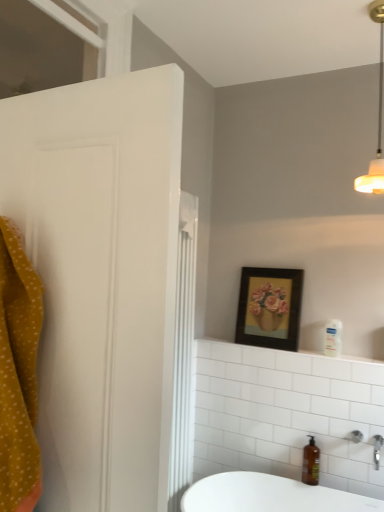
Question: Does transparent glass window at upper left have a lesser height compared to white glossy shelf at upper center?

Choices:
 (A) no
 (B) yes

Answer: (A)

Question: Is transparent glass window at upper left positioned in front of white glossy shelf at upper center?

Choices:
 (A) yes
 (B) no

Answer: (A)

Question: Is white glossy shelf at upper center located within transparent glass window at upper left?

Choices:
 (A) yes
 (B) no

Answer: (B)

Question: Can you confirm if transparent glass window at upper left is thinner than white glossy shelf at upper center?

Choices:
 (A) yes
 (B) no

Answer: (A)

Question: Does transparent glass window at upper left have a greater height compared to white glossy shelf at upper center?

Choices:
 (A) no
 (B) yes

Answer: (B)

Question: In the image, is wooden framed picture at upper center on the left side or the right side of white matte light fixture at upper right?

Choices:
 (A) right
 (B) left

Answer: (B)

Question: Considering the positions of wooden framed picture at upper center and white matte light fixture at upper right in the image, is wooden framed picture at upper center bigger or smaller than white matte light fixture at upper right?

Choices:
 (A) big
 (B) small

Answer: (B)

Question: From the image's perspective, is wooden framed picture at upper center located above or below white matte light fixture at upper right?

Choices:
 (A) below
 (B) above

Answer: (A)

Question: From their relative heights in the image, would you say wooden framed picture at upper center is taller or shorter than white matte light fixture at upper right?

Choices:
 (A) short
 (B) tall

Answer: (A)

Question: Is silver metallic faucet at lower right spatially inside white glossy shelf at upper center, or outside of it?

Choices:
 (A) inside
 (B) outside

Answer: (B)

Question: Is point (377, 456) positioned closer to the camera than point (382, 352)?

Choices:
 (A) farther
 (B) closer

Answer: (B)

Question: Is silver metallic faucet at lower right wider or thinner than white glossy shelf at upper center?

Choices:
 (A) wide
 (B) thin

Answer: (A)

Question: Considering their positions, is silver metallic faucet at lower right located in front of or behind white glossy shelf at upper center?

Choices:
 (A) front
 (B) behind

Answer: (A)

Question: Is white glossy shelf at upper center taller or shorter than white matte light fixture at upper right?

Choices:
 (A) short
 (B) tall

Answer: (A)

Question: In the image, is white glossy shelf at upper center positioned in front of or behind white matte light fixture at upper right?

Choices:
 (A) front
 (B) behind

Answer: (B)